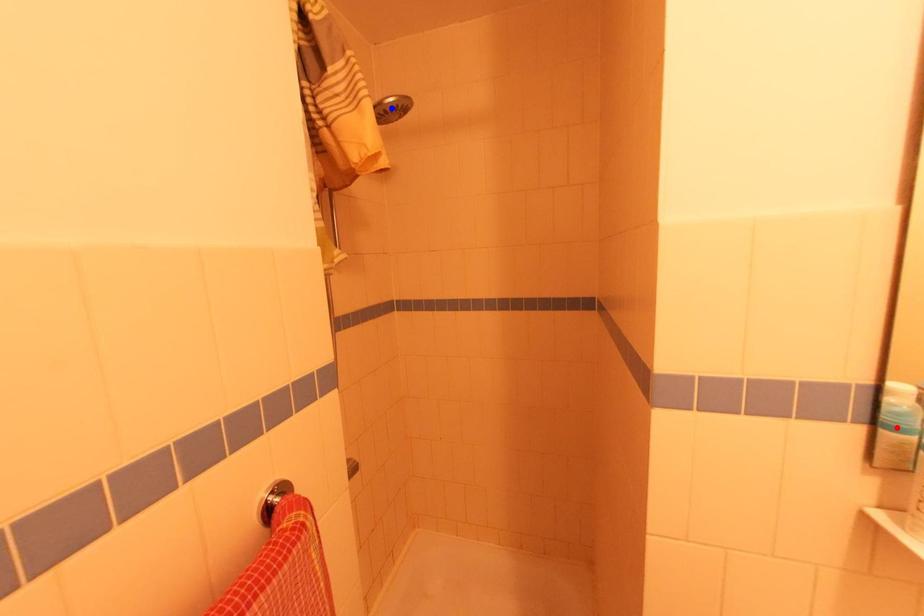
Question: Which of the two points in the image is closer to the camera?

Choices:
 (A) Blue point is closer.
 (B) Red point is closer.

Answer: (B)